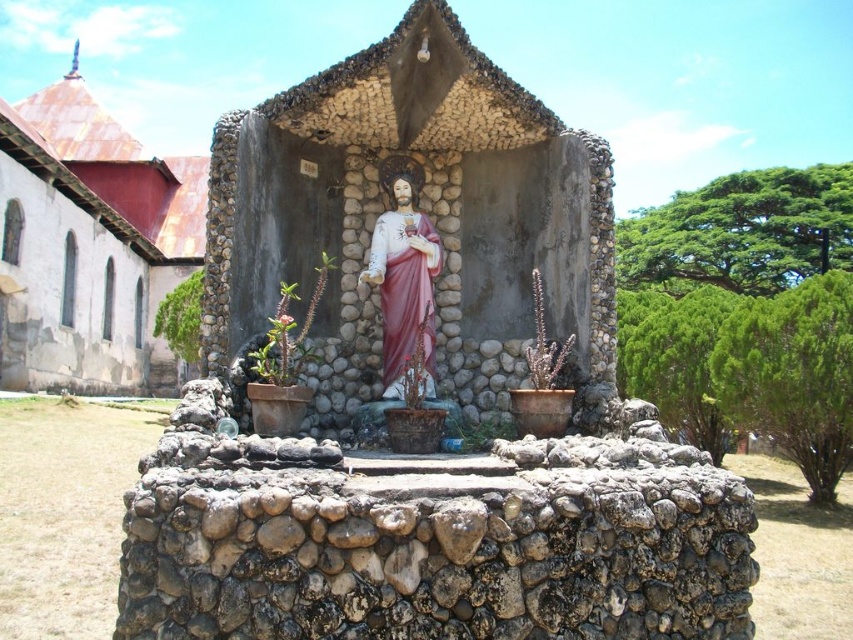
Looking at this image, is rusty metal roof at left above matte pink statue at center?

Yes.

Where is `rusty metal roof at left`? The image size is (853, 640). rusty metal roof at left is located at coordinates (90, 244).